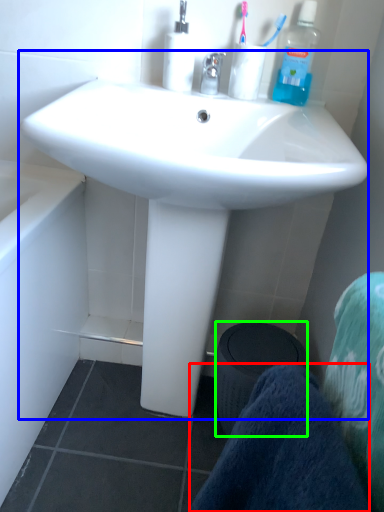
Question: Based on their relative distances, which object is nearer to towel/napkin (highlighted by a red box)? Choose from sink (highlighted by a blue box) and trash bin/can (highlighted by a green box).

Choices:
 (A) sink
 (B) trash bin/can

Answer: (A)